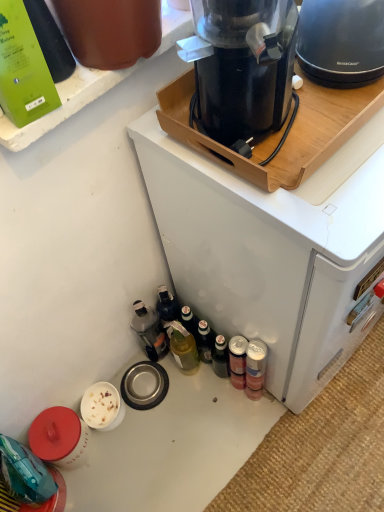
Where is `vacant space to the left of metallic silver can at lower right, marked as the second bottle in a front-to-back arrangement`? vacant space to the left of metallic silver can at lower right, marked as the second bottle in a front-to-back arrangement is located at coordinates (205, 413).